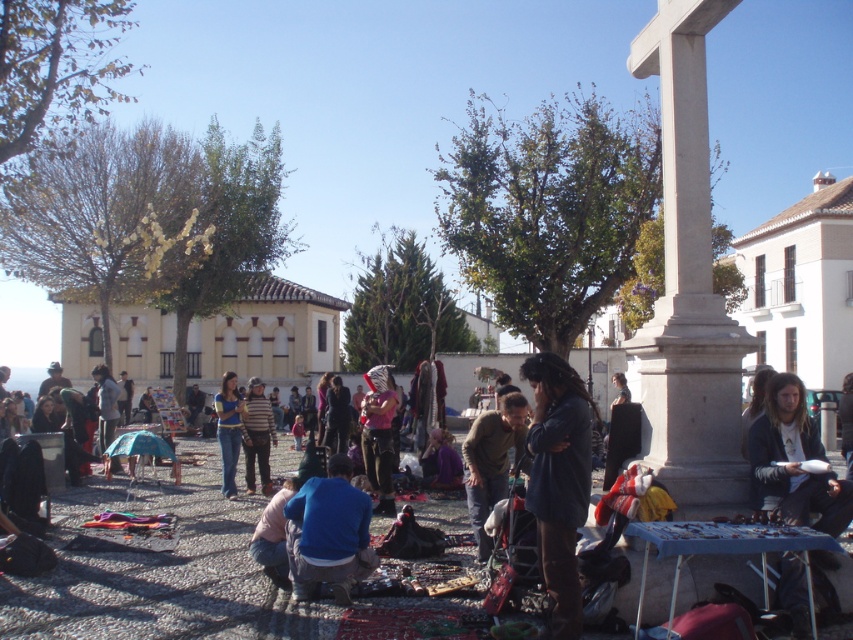
Question: Is dark blue denim jacket at center to the right of striped knit sweater at center from the viewer's perspective?

Choices:
 (A) yes
 (B) no

Answer: (A)

Question: Among these points, which one is farthest from the camera?

Choices:
 (A) (224, 413)
 (B) (796, 444)
 (C) (485, 472)

Answer: (A)

Question: Does dark blue denim jacket at center have a smaller size compared to blue denim jeans at center?

Choices:
 (A) yes
 (B) no

Answer: (A)

Question: Is blue cotton shirt at center above greenish-gray sweater at center?

Choices:
 (A) yes
 (B) no

Answer: (B)

Question: Which of the following is the closest to the observer?

Choices:
 (A) blue cotton shirt at center
 (B) matte pink shirt at center
 (C) blue denim jeans at center

Answer: (A)

Question: Which of these objects is positioned closest to the dark brown leather jacket at lower right?

Choices:
 (A) striped knit sweater at center
 (B) dark blue denim jacket at center
 (C) blue denim jeans at center

Answer: (B)